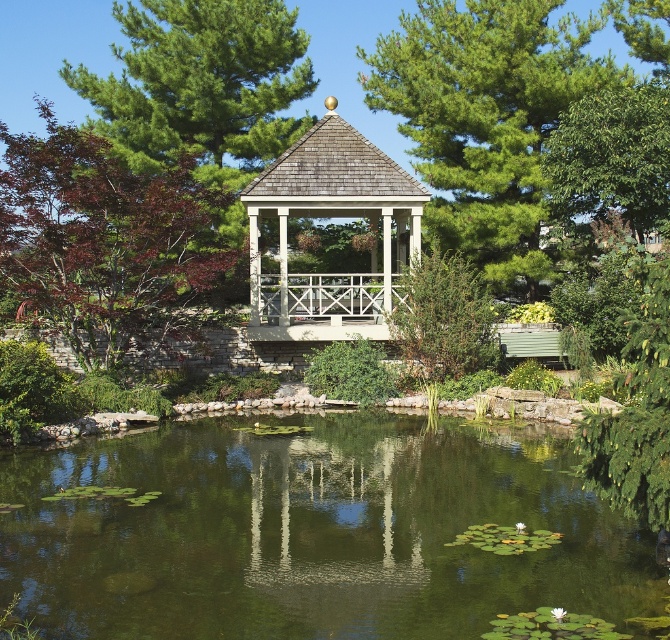
You are a bird looking for a nesting spot. You see the green textured pine tree at upper left and the green leafy tree at upper right. Which tree would you choose if you prefer a larger tree for nesting?

The green textured pine tree at upper left is larger in size than the green leafy tree at upper right, so you should choose the green textured pine tree at upper left for nesting.

You are standing in the garden looking towards the pond. You see the green pine tree at upper center and the wooden gazebo at center. Which object is positioned to the right side of the other?

The green pine tree at upper center is positioned to the right of the wooden gazebo at center.